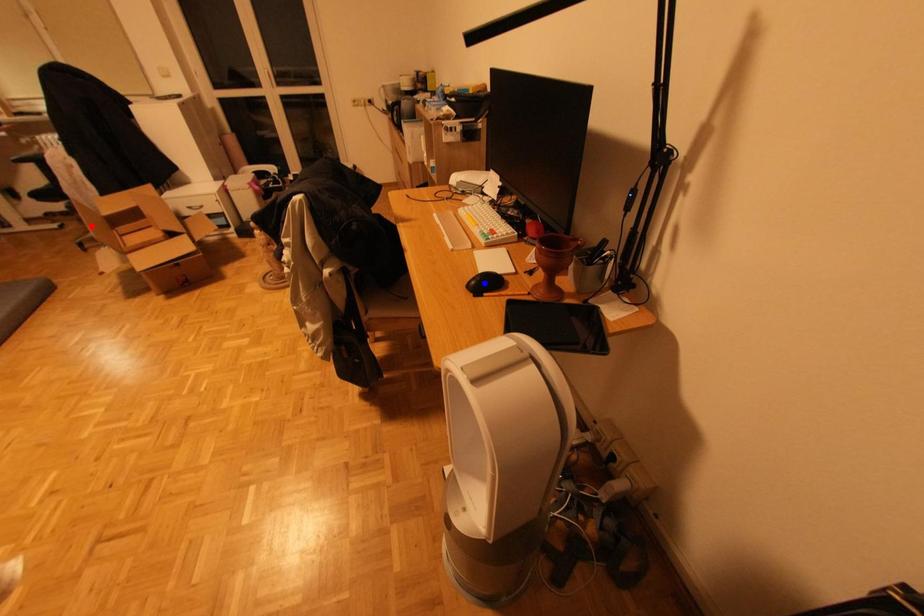
Question: Two points are marked on the image. Which point is closer to the camera?

Choices:
 (A) Blue point is closer.
 (B) Red point is closer.

Answer: (A)